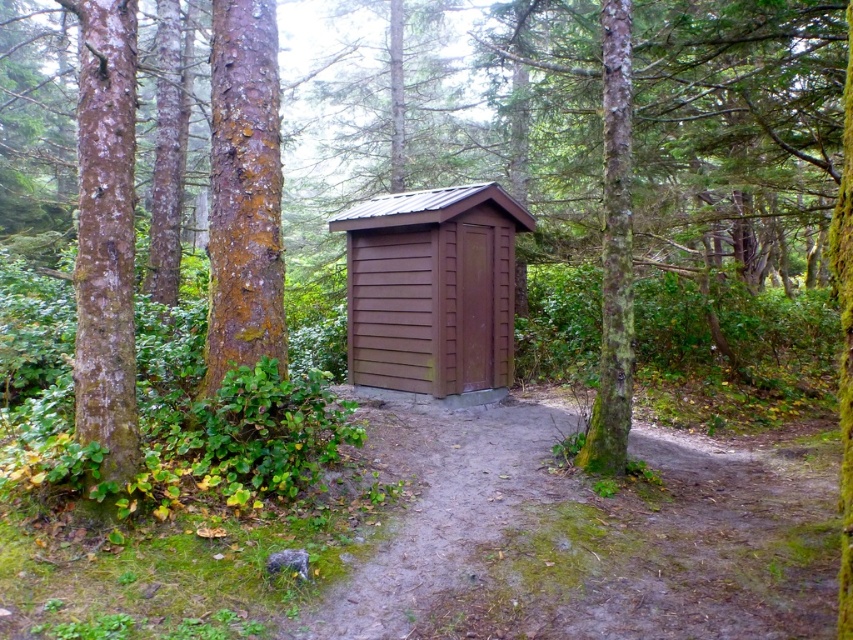
You are standing in front of the outhouse and notice a smooth brown bark at center. Can you determine the exact coordinates of this bark relative to the image frame?

The smooth brown bark at center is located at point [244,192] within the image frame.

You are standing in front of the smooth brown bark at center. You want to throw a small stone to hit a tree 10 meters away from you. Can you reach the target with one throw?

The smooth brown bark at center and viewer are 4.86 meters apart from each other. Since the target is 10 meters away, you cannot reach it with one throw as the distance is greater than the throwing range.

You are planning to build a new shed in your backyard. You want to ensure that the shed you plan to build is wider than the existing green mossy tree trunk at center. Based on the image, is the brown wood shed at center a good example to follow for the width requirement?

The brown wood shed at center has a width that surpasses the green mossy tree trunk at center, so yes, it is a good example to follow for the width requirement.